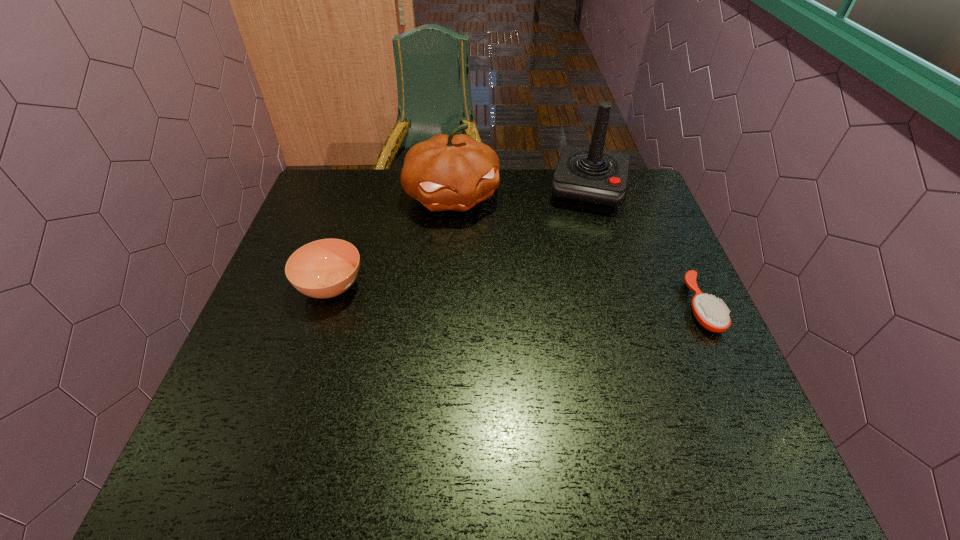
Where is `vacant spot on the desktop that is between the third tallest object and the rightmost object and is positioned on the front face of the pumpkin`? vacant spot on the desktop that is between the third tallest object and the rightmost object and is positioned on the front face of the pumpkin is located at coordinates (512, 296).

At what (x,y) coordinates should I click in order to perform the action: click on free spot on the desktop that is between the soup bowl and the shortest object and is positioned on the front-facing side of the joystick. Please return your answer as a coordinate pair (x, y). Looking at the image, I should click on 564,299.